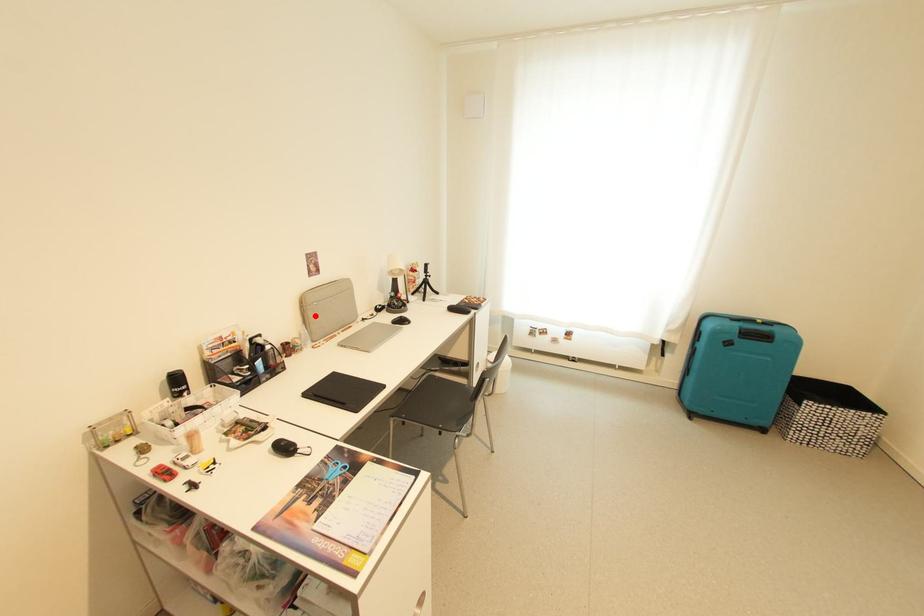
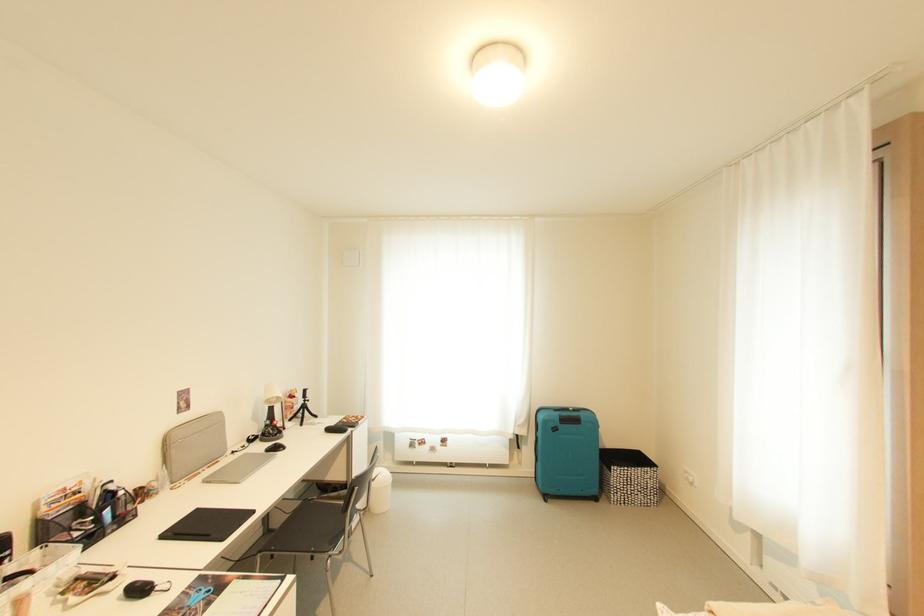
Question: I am providing you with two images of the same scene from different viewpoints. A red point is shown in image1. For the corresponding object point in image2, is it positioned nearer or farther from the camera?

Choices:
 (A) Nearer
 (B) Farther

Answer: (B)